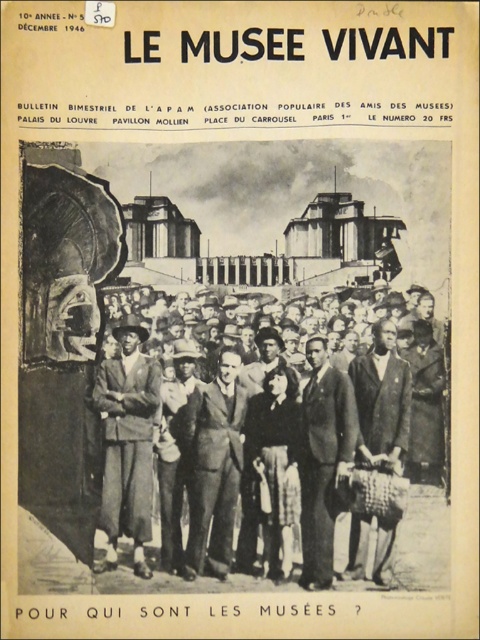
Looking at this image, can you confirm if matte black suit at center is positioned below dark brown suit at center?

No, matte black suit at center is not below dark brown suit at center.

Which is more to the left, matte black suit at center or dark brown suit at center?

From the viewer's perspective, matte black suit at center appears more on the left side.

Is point (104, 369) closer to viewer compared to point (307, 582)?

No.

This screenshot has width=480, height=640. In order to click on matte black suit at center in this screenshot , I will do `click(128, 442)`.

In the scene shown: Can you confirm if matte black suit at center is positioned above dark brown leather coat at center?

Correct, matte black suit at center is located above dark brown leather coat at center.

Is point (110, 396) farther from viewer compared to point (368, 362)?

That is False.

Which is in front, point (106, 403) or point (408, 392)?

Point (106, 403) is more forward.

Identify the location of matte black suit at center. (128, 442).

This screenshot has height=640, width=480. I want to click on smooth suit at center, so click(312, 467).

Is point (336, 435) in front of point (230, 384)?

Yes, point (336, 435) is closer to viewer.

Is point (238, 544) behind point (201, 417)?

No, it is not.

Identify the location of smooth suit at center. (312, 467).